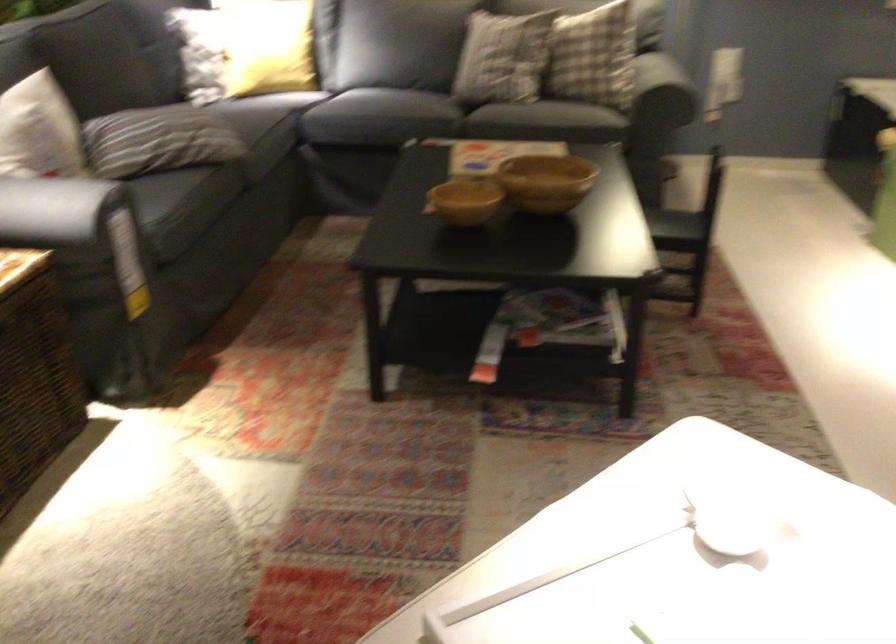
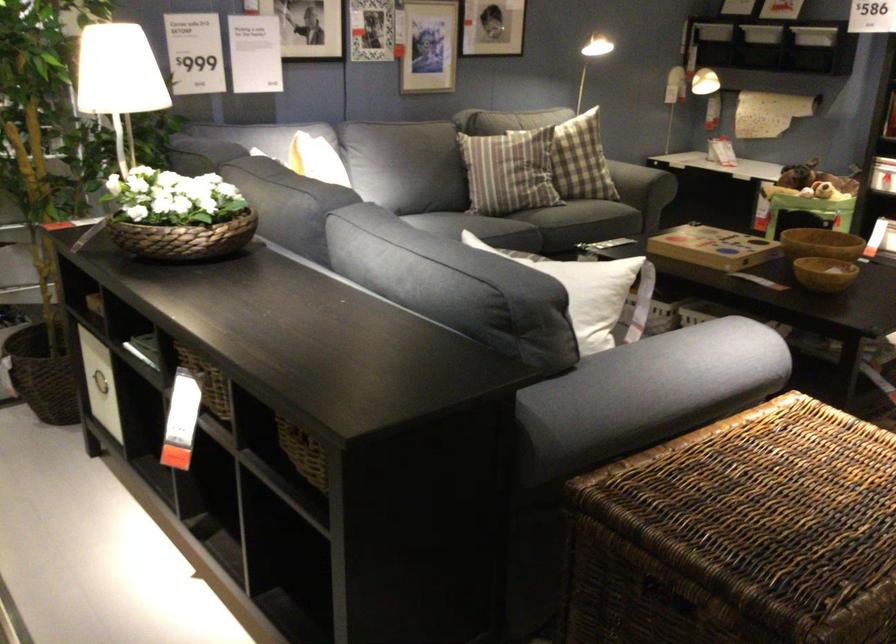
Locate, in the second image, the point that corresponds to (561,67) in the first image.

(633, 180)